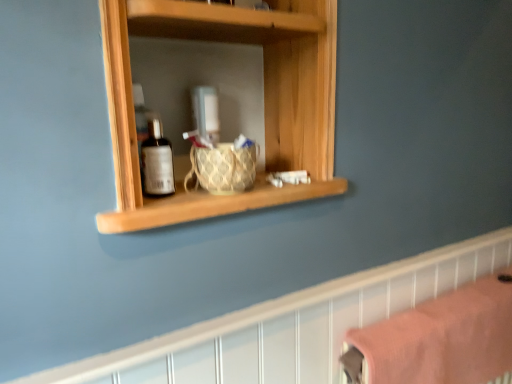
Question: Is wooden shelf at center oriented away from wooden shelf at upper center?

Choices:
 (A) no
 (B) yes

Answer: (A)

Question: Is wooden shelf at center next to wooden shelf at upper center and touching it?

Choices:
 (A) no
 (B) yes

Answer: (A)

Question: From the image's perspective, does wooden shelf at center appear lower than wooden shelf at upper center?

Choices:
 (A) yes
 (B) no

Answer: (B)

Question: Is wooden shelf at center positioned in front of wooden shelf at upper center?

Choices:
 (A) yes
 (B) no

Answer: (A)

Question: Can you confirm if wooden shelf at center is thinner than wooden shelf at upper center?

Choices:
 (A) yes
 (B) no

Answer: (B)

Question: Considering the relative sizes of wooden shelf at center and wooden shelf at upper center in the image provided, is wooden shelf at center shorter than wooden shelf at upper center?

Choices:
 (A) no
 (B) yes

Answer: (A)

Question: Can you confirm if woven fabric basket at center is bigger than pink fabric towel at lower right?

Choices:
 (A) yes
 (B) no

Answer: (B)

Question: Is woven fabric basket at center oriented towards pink fabric towel at lower right?

Choices:
 (A) no
 (B) yes

Answer: (A)

Question: Is woven fabric basket at center at the right side of pink fabric towel at lower right?

Choices:
 (A) no
 (B) yes

Answer: (A)

Question: From a real-world perspective, is woven fabric basket at center under pink fabric towel at lower right?

Choices:
 (A) no
 (B) yes

Answer: (A)

Question: Is woven fabric basket at center facing away from pink fabric towel at lower right?

Choices:
 (A) yes
 (B) no

Answer: (B)

Question: Can you confirm if woven fabric basket at center is shorter than pink fabric towel at lower right?

Choices:
 (A) yes
 (B) no

Answer: (A)

Question: Considering the relative sizes of pink fabric towel at lower right and wooden shelf at upper center in the image provided, is pink fabric towel at lower right thinner than wooden shelf at upper center?

Choices:
 (A) yes
 (B) no

Answer: (B)